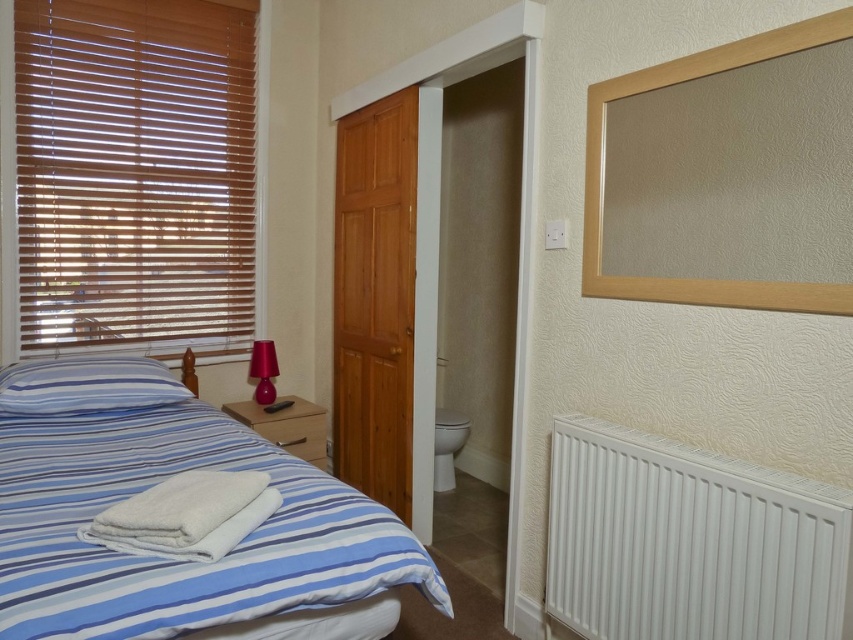
Consider the image. Between wooden blinds at upper left and white glossy toilet bowl at center, which one has less height?

Standing shorter between the two is white glossy toilet bowl at center.

Which is behind, point (32, 120) or point (439, 444)?

The point (439, 444) is more distant.

The height and width of the screenshot is (640, 853). I want to click on wooden blinds at upper left, so click(x=134, y=177).

Is white matte radiator at lower right positioned before white glossy toilet bowl at center?

Yes.

Does point (840, 528) come farther from viewer compared to point (447, 474)?

No.

This screenshot has width=853, height=640. In order to click on white matte radiator at lower right in this screenshot , I will do `click(688, 541)`.

Can you confirm if wooden blinds at upper left is wider than white matte radiator at lower right?

Correct, the width of wooden blinds at upper left exceeds that of white matte radiator at lower right.

From the picture: Which of these two, wooden blinds at upper left or white matte radiator at lower right, stands taller?

wooden blinds at upper left is taller.

Between point (192, 93) and point (726, 593), which one is positioned behind?

The point (192, 93) is more distant.

You are a GUI agent. You are given a task and a screenshot of the screen. Output one action in this format:
    pyautogui.click(x=<x>, y=<y>)
    Task: Click on the wooden blinds at upper left
    This screenshot has height=640, width=853.
    Given the screenshot: What is the action you would take?
    pyautogui.click(x=134, y=177)